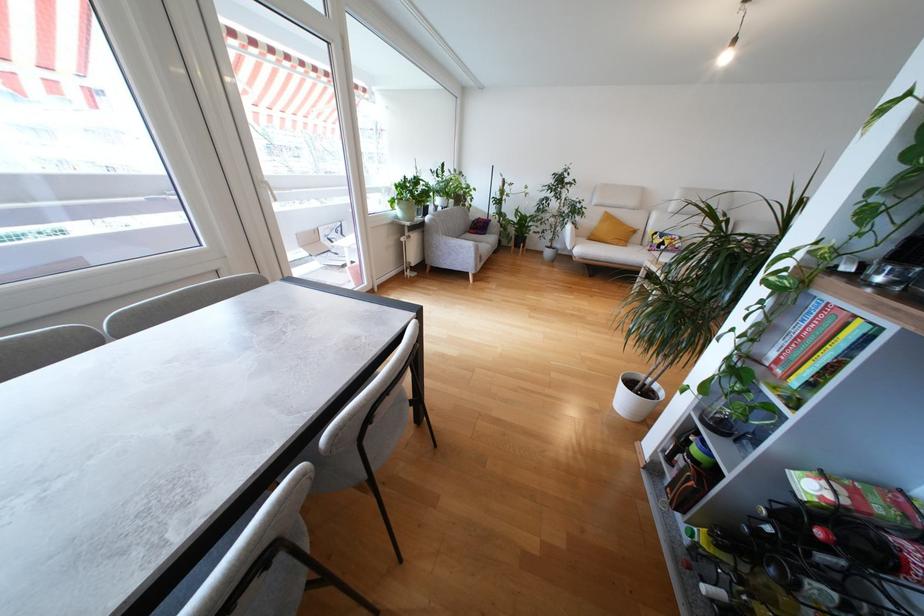
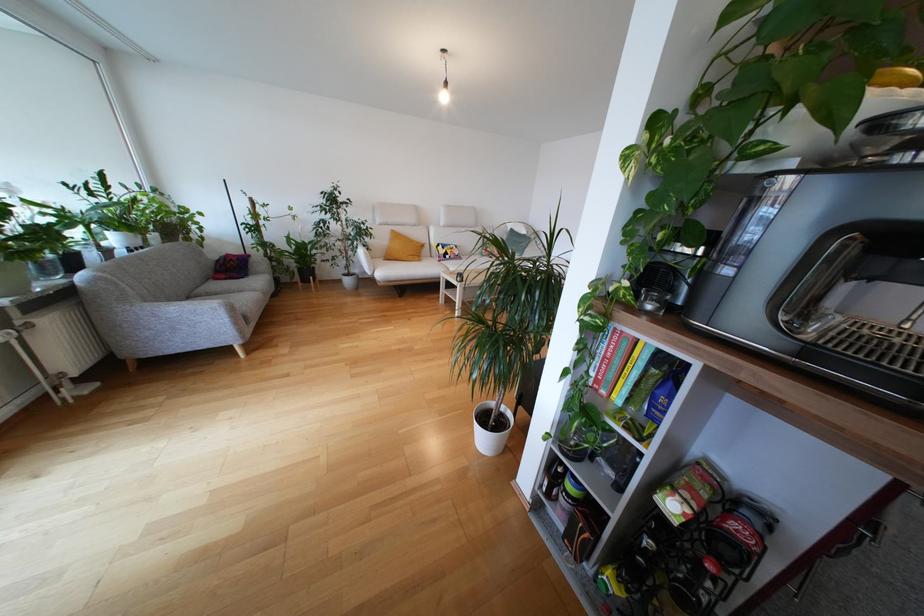
Find the pixel in the second image that matches (x=831, y=338) in the first image.

(630, 358)